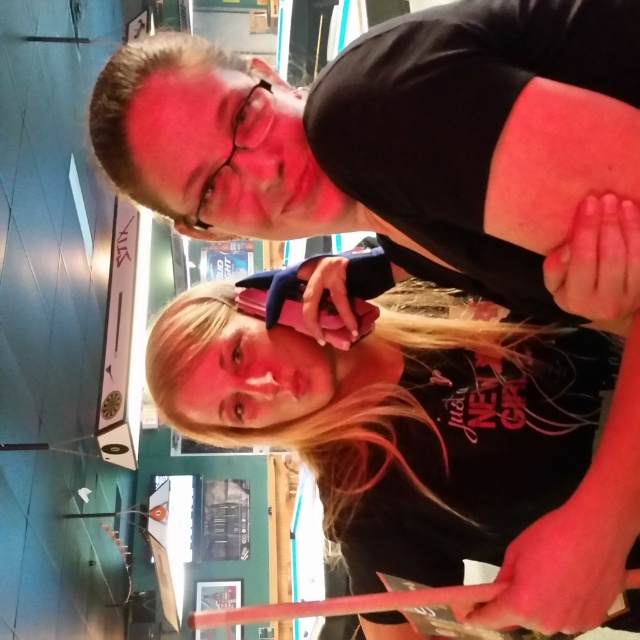
Question: Is the position of black matte phone at center less distant than that of dark brown hair at upper center?

Choices:
 (A) no
 (B) yes

Answer: (B)

Question: Among these objects, which one is farthest from the camera?

Choices:
 (A) black matte phone at center
 (B) matte black phone at upper center
 (C) dark brown hair at upper center

Answer: (C)

Question: Considering the real-world distances, which object is farthest from the black matte phone at center?

Choices:
 (A) dark brown hair at upper center
 (B) matte black phone at upper center

Answer: (A)

Question: Can you confirm if black matte phone at center is wider than dark brown hair at upper center?

Choices:
 (A) yes
 (B) no

Answer: (A)

Question: Which point is closer to the camera taking this photo?

Choices:
 (A) (493, 237)
 (B) (484, 621)
 (C) (136, 70)

Answer: (A)

Question: Is matte black phone at upper center to the right of dark brown hair at upper center from the viewer's perspective?

Choices:
 (A) no
 (B) yes

Answer: (B)